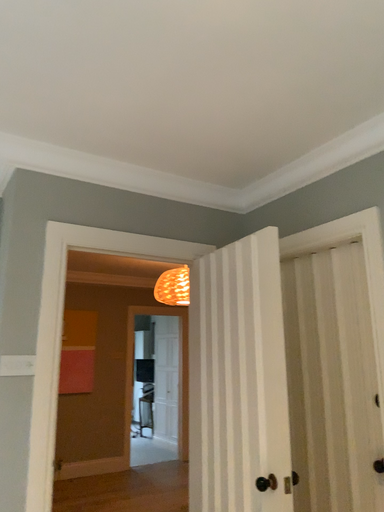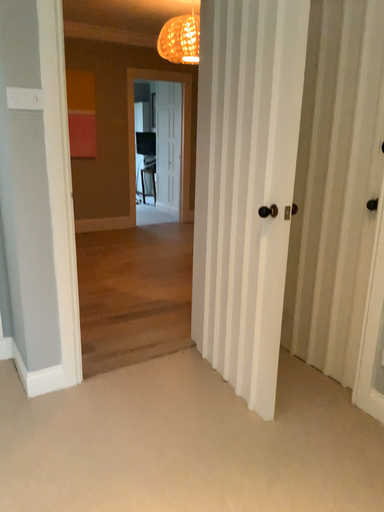
Question: Which way did the camera rotate in the video?

Choices:
 (A) rotated upward
 (B) rotated downward

Answer: (B)